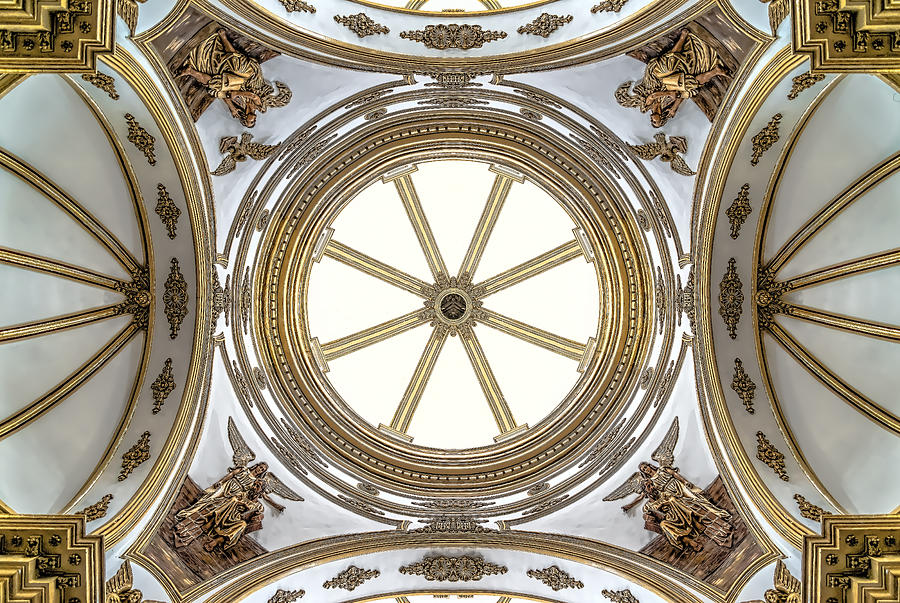
The height and width of the screenshot is (603, 900). Identify the location of white ceiling. [94, 418].